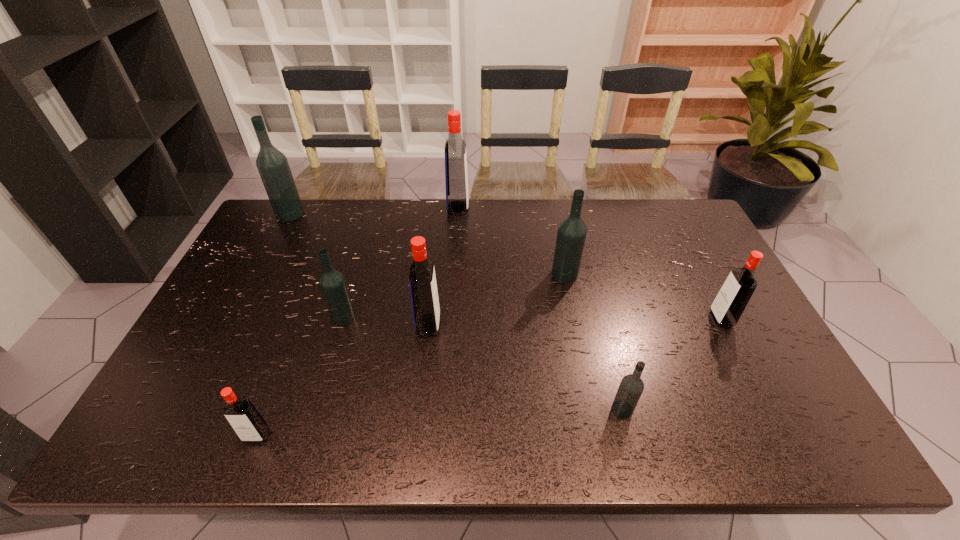
At what (x,y) coordinates should I click in order to perform the action: click on free space located on the front and back of the rightmost vodka. Please return your answer as a coordinate pair (x, y). The width and height of the screenshot is (960, 540). Looking at the image, I should click on (655, 319).

Where is `vacant space located on the front of the sixth vodka from right to left`? The image size is (960, 540). vacant space located on the front of the sixth vodka from right to left is located at coordinates (326, 375).

I want to click on vacant space located 0.090m on the left of the seventh vodka from left to right, so click(x=573, y=409).

Locate an element on the screen. object that is at the left edge is located at coordinates (273, 167).

Find the location of `object that is at the right edge`. object that is at the right edge is located at coordinates (729, 304).

The height and width of the screenshot is (540, 960). I want to click on object situated at the far left corner, so click(x=273, y=167).

Find the location of a particular element. Image resolution: width=960 pixels, height=540 pixels. free region at the far edge is located at coordinates coord(381,222).

Locate an element on the screen. vacant point at the near edge is located at coordinates (644, 441).

In the image, there is a desktop. Where is `vacant area at the left edge`? vacant area at the left edge is located at coordinates [x=262, y=291].

The image size is (960, 540). I want to click on vacant space at the right edge, so click(x=687, y=272).